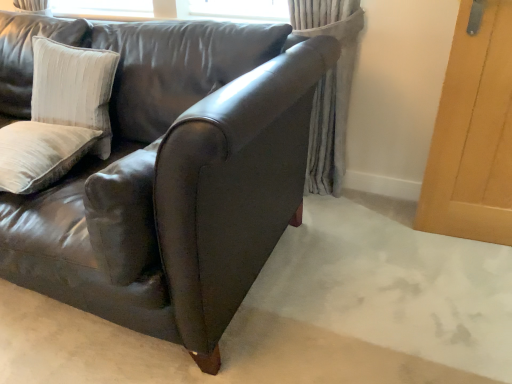
Question: Should I look upward or downward to see shiny leather couch at center?

Choices:
 (A) down
 (B) up

Answer: (B)

Question: Is gray textured curtain at center to the left of shiny leather couch at center from the viewer's perspective?

Choices:
 (A) no
 (B) yes

Answer: (A)

Question: Does gray textured curtain at center have a lesser height compared to shiny leather couch at center?

Choices:
 (A) yes
 (B) no

Answer: (B)

Question: Considering the relative sizes of gray textured curtain at center and shiny leather couch at center in the image provided, is gray textured curtain at center taller than shiny leather couch at center?

Choices:
 (A) yes
 (B) no

Answer: (A)

Question: From the image's perspective, is gray textured curtain at center located above shiny leather couch at center?

Choices:
 (A) no
 (B) yes

Answer: (B)

Question: Can you confirm if gray textured curtain at center is wider than shiny leather couch at center?

Choices:
 (A) yes
 (B) no

Answer: (B)

Question: From a real-world perspective, is gray textured curtain at center physically above shiny leather couch at center?

Choices:
 (A) yes
 (B) no

Answer: (A)

Question: Can we say gray textured curtain at center lies outside velvet beige pillow at upper left, which is counted as the 2th pillow, starting from the bottom?

Choices:
 (A) no
 (B) yes

Answer: (B)

Question: Can you confirm if gray textured curtain at center is positioned to the left of velvet beige pillow at upper left, which is counted as the 2th pillow, starting from the bottom?

Choices:
 (A) no
 (B) yes

Answer: (A)

Question: Is gray textured curtain at center turned away from velvet beige pillow at upper left, which is the 1th pillow from top to bottom?

Choices:
 (A) no
 (B) yes

Answer: (A)

Question: From the image's perspective, is gray textured curtain at center above velvet beige pillow at upper left, which is counted as the 2th pillow, starting from the bottom?

Choices:
 (A) yes
 (B) no

Answer: (A)

Question: From a real-world perspective, does gray textured curtain at center stand above velvet beige pillow at upper left, which is counted as the 2th pillow, starting from the bottom?

Choices:
 (A) no
 (B) yes

Answer: (A)

Question: Are gray textured curtain at center and velvet beige pillow at upper left, which is counted as the 2th pillow, starting from the bottom, beside each other?

Choices:
 (A) no
 (B) yes

Answer: (A)

Question: Does beige velvet pillow at left, marked as the 1th pillow in a bottom-to-top arrangement, turn towards velvet beige pillow at upper left, which is counted as the 2th pillow, starting from the bottom?

Choices:
 (A) yes
 (B) no

Answer: (B)